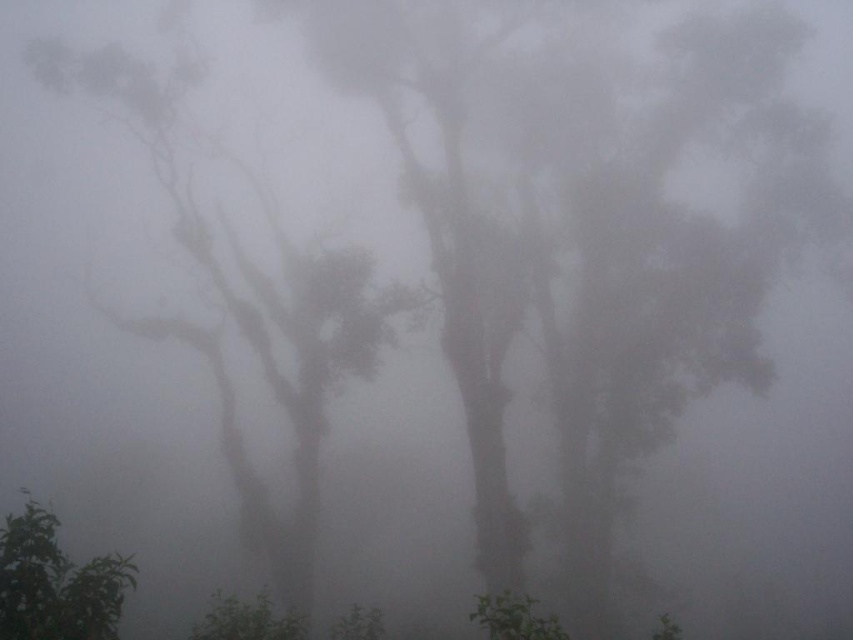
From the picture: You are in a misty forest and want to locate the foggy translucent tree at left. What are the coordinates of its position?

The foggy translucent tree at left is located at coordinates point (x=251, y=308).

You are a hiker trying to navigate through the misty forest. You see the foggy translucent tree at left and the green leafy tree at lower left. How far apart are these two trees?

The foggy translucent tree at left is 143.47 feet from the green leafy tree at lower left.